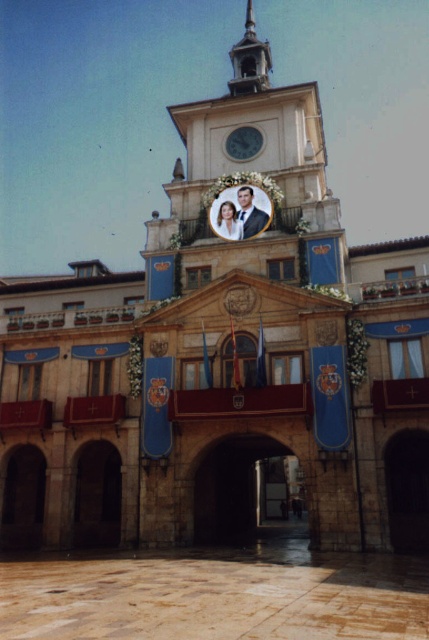
Who is higher up, smooth stone clock tower at center or polished wood spire at upper center?

Positioned higher is polished wood spire at upper center.

Who is more distant from viewer, (232, 60) or (247, 92)?

The point (232, 60) is more distant.

Where is `smooth stone clock tower at center`? Image resolution: width=429 pixels, height=640 pixels. smooth stone clock tower at center is located at coordinates (251, 177).

Who is lower down, polished wood spire at upper center or metallic clock face at center?

metallic clock face at center

What do you see at coordinates (250, 60) in the screenshot? The image size is (429, 640). I see `polished wood spire at upper center` at bounding box center [250, 60].

Where is `polished wood spire at upper center`? The height and width of the screenshot is (640, 429). polished wood spire at upper center is located at coordinates (250, 60).

Is smooth stone clock tower at center to the right of metallic clock face at center from the viewer's perspective?

Yes, smooth stone clock tower at center is to the right of metallic clock face at center.

Is smooth stone clock tower at center positioned behind metallic clock face at center?

That is False.

Between point (311, 116) and point (260, 140), which one is positioned in front?

Positioned in front is point (260, 140).

The image size is (429, 640). In order to click on smooth stone clock tower at center in this screenshot , I will do `click(251, 177)`.